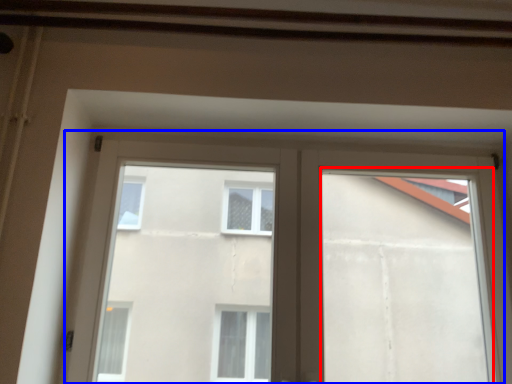
Question: Among these objects, which one is nearest to the camera, window frame (highlighted by a red box) or window (highlighted by a blue box)?

Choices:
 (A) window frame
 (B) window

Answer: (A)